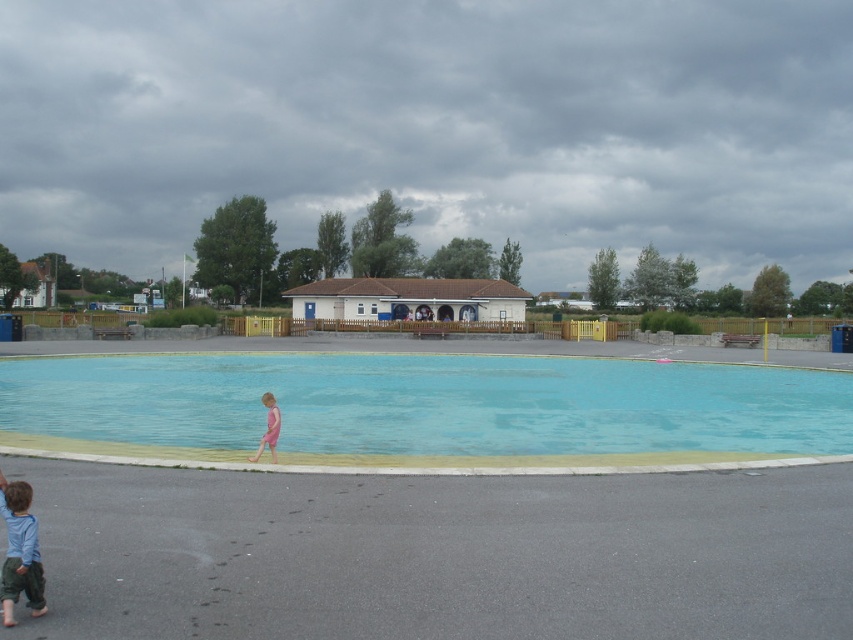
Question: Can you confirm if blue cotton shirt at lower left is positioned below pink matte swimsuit at lower center?

Choices:
 (A) yes
 (B) no

Answer: (B)

Question: Which point is closer to the camera?

Choices:
 (A) pink matte swimsuit at lower center
 (B) blue cotton shirt at lower left

Answer: (B)

Question: Does blue smooth water at center have a smaller size compared to blue cotton shirt at lower left?

Choices:
 (A) yes
 (B) no

Answer: (B)

Question: Which object is closer to the camera taking this photo?

Choices:
 (A) blue cotton shirt at lower left
 (B) pink matte swimsuit at lower center
 (C) blue smooth water at center

Answer: (A)

Question: Which of these objects is positioned farthest from the blue smooth water at center?

Choices:
 (A) pink matte swimsuit at lower center
 (B) blue cotton shirt at lower left

Answer: (B)

Question: Can you confirm if blue smooth water at center is positioned below blue cotton shirt at lower left?

Choices:
 (A) yes
 (B) no

Answer: (A)